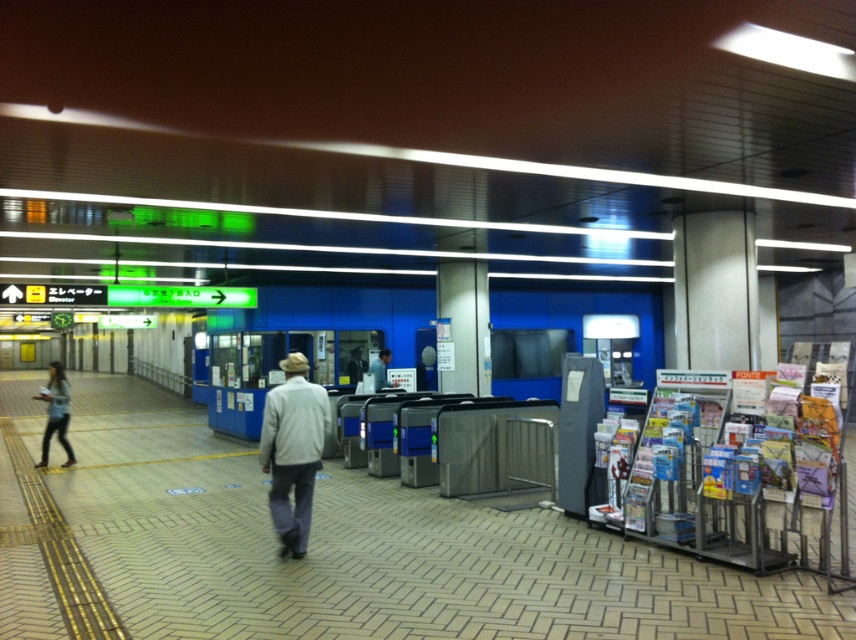
You are a commuter waiting at the subway station. You see a denim jacket at left and a light blue shirt at center. Which clothing item is closer to the floor?

The denim jacket at left is positioned under the light blue shirt at center, so it is closer to the floor.

You are a photographer standing in the subway station and want to take a photo of both the light gray fabric jacket at center and the light blue shirt at center. Which one should you focus on first to ensure both are in sharp focus?

You should focus on the light gray fabric jacket at center first because it is closer to the viewer than the light blue shirt at center, ensuring both will be in focus when using a shallow depth of field.